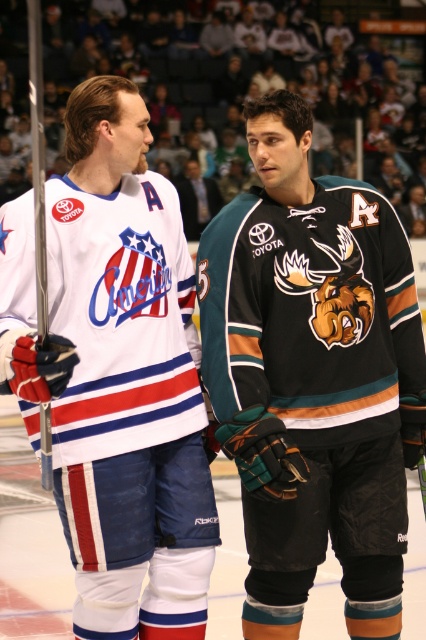
You are an ice hockey fan watching a game. You see the white matte hockey jersey at left and the dark blue jersey at center. Which jersey is positioned more to the right side of the rink?

The white matte hockey jersey at left is positioned more to the right side of the rink compared to the dark blue jersey at center because it is located to the right of it.